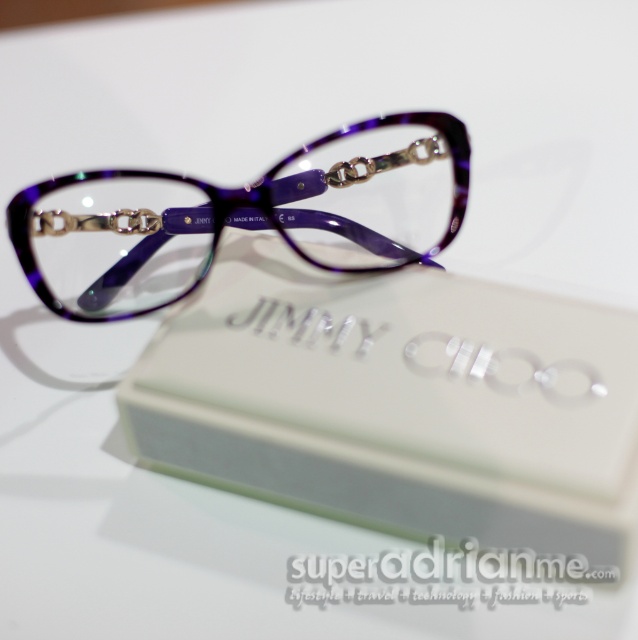
You are a photographer setting up a still life shot. You have a matte purple plastic box at center placed 35.19 inches from the camera. You want to ensure that the box is in focus while the background remains slightly blurred. What adjustment should you make to the camera settings to achieve this effect?

To achieve a focused matte purple plastic box at center with a blurred background, adjust the camera aperture to a wider setting, such as a lower fstop number, which will create a shallower depth of field.

You are a delivery person who needs to pack the matte purple plastic box at center and the purple marbled glasses at center into a shipping box. The shipping box has a height limit of 5 cm. Which item will not fit if placed vertically?

The purple marbled glasses at center will not fit because the matte purple plastic box at center is thinner than the purple marbled glasses at center, so the glasses are thicker and exceed the 5 cm height limit.

You are an interior designer trying to place a small decorative item between the two points, point [424,385] and point [272,225]. Which point should the item be closer to if it needs to be placed at the same depth level as the closer point?

The item should be placed closer to point [424,385] because it is closer to the viewer than point [272,225].